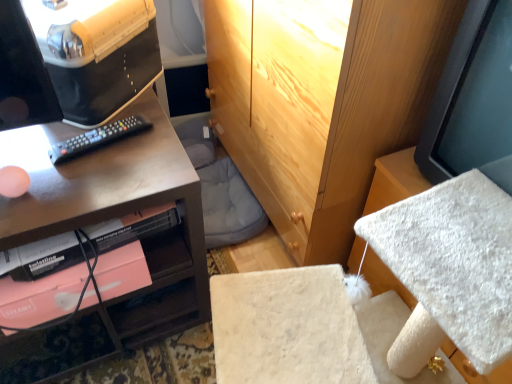
Locate an element on the screen. free space in front of black plastic remote at left is located at coordinates (77, 190).